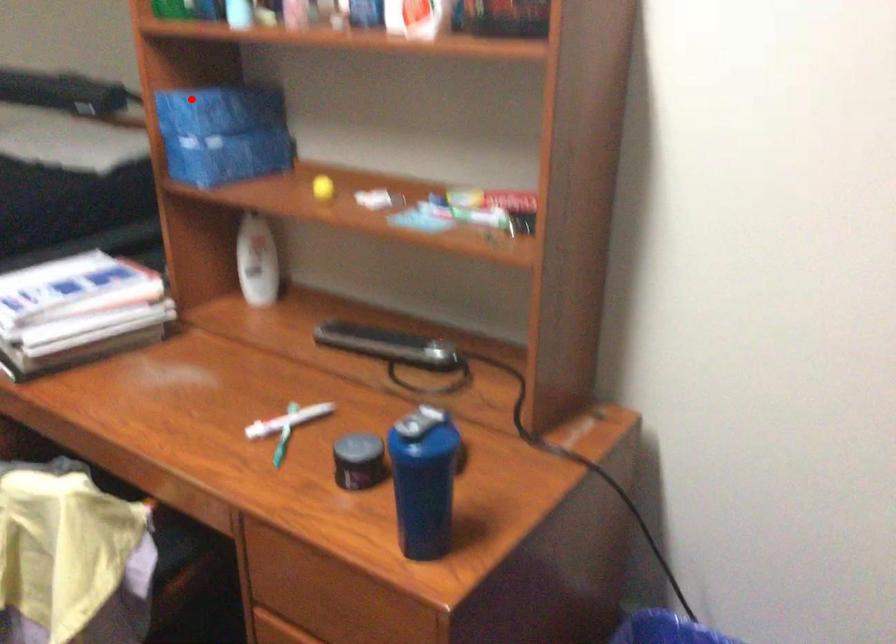
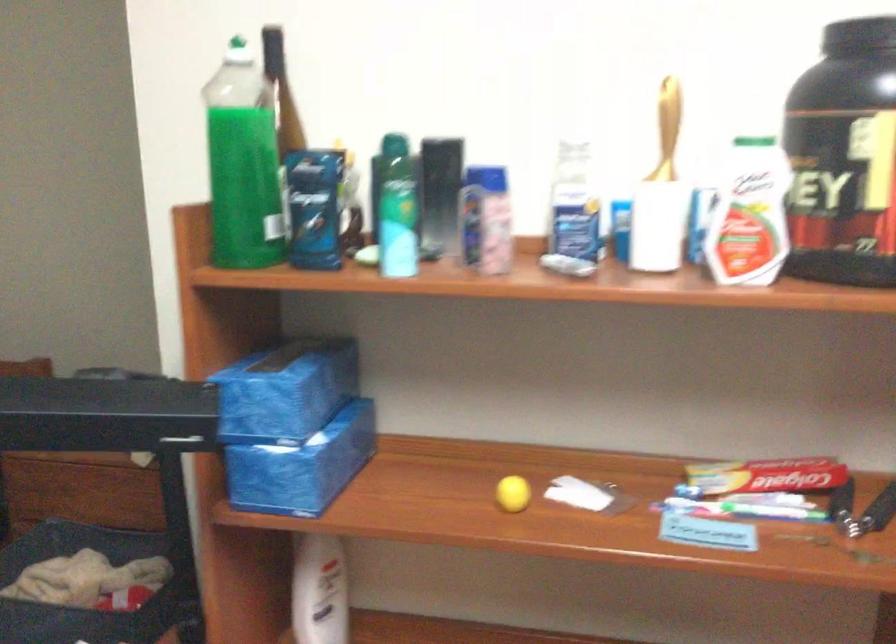
Question: I am providing you with two images of the same scene from different viewpoints. Given a red point in image1, look at the same physical point in image2. Is it:

Choices:
 (A) Closer to the viewpoint
 (B) Farther from the viewpoint

Answer: (A)